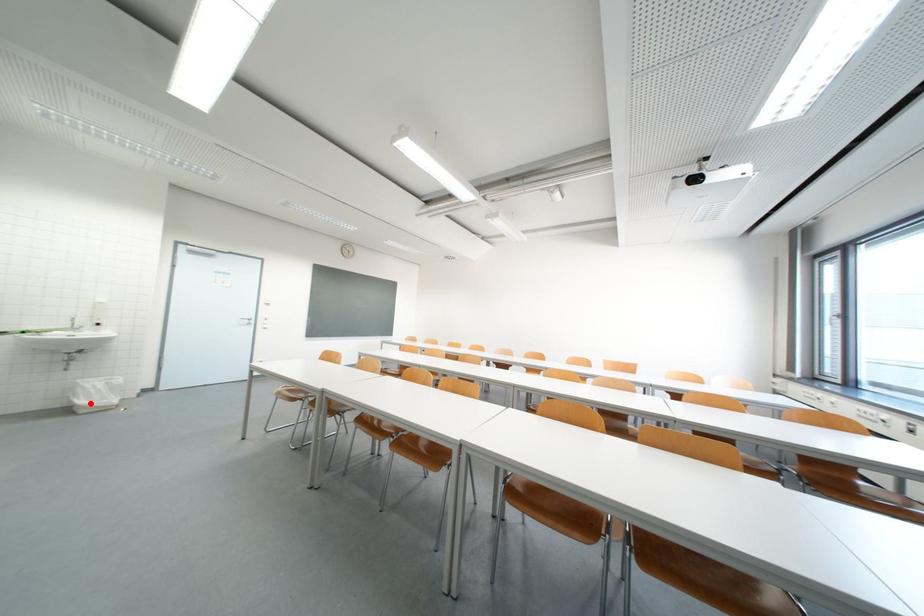
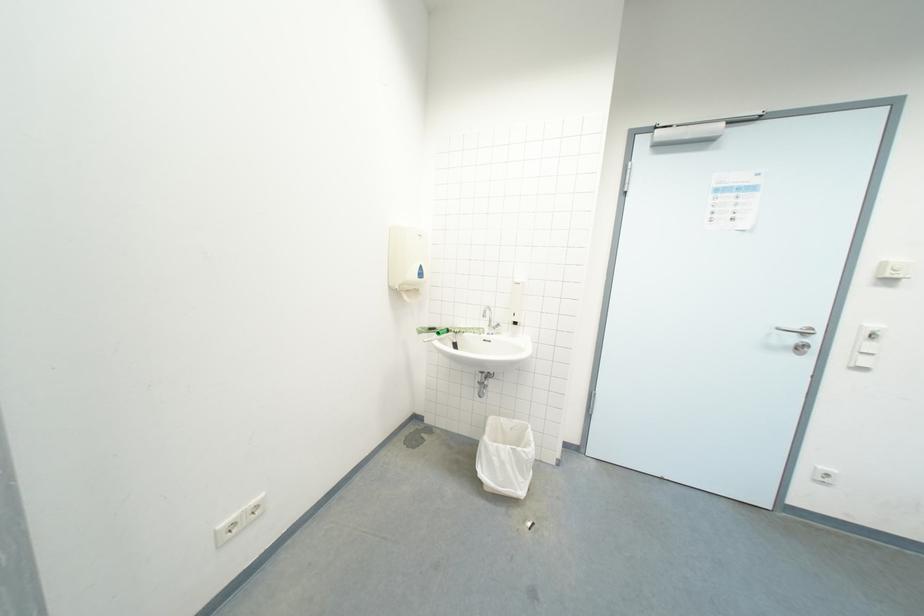
Question: A red point is marked in image1. In image2, is the corresponding 3D point closer to the camera or farther? Reply with the corresponding letter.

Choices:
 (A) The corresponding 3D point is closer.
 (B) The corresponding 3D point is farther.

Answer: (B)